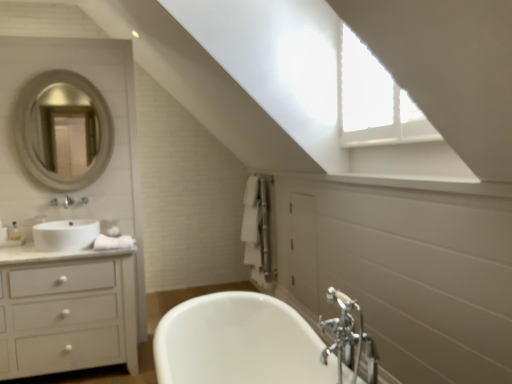
What do you see at coordinates (65, 234) in the screenshot? Image resolution: width=512 pixels, height=384 pixels. I see `white glossy sink at left` at bounding box center [65, 234].

Image resolution: width=512 pixels, height=384 pixels. What do you see at coordinates (66, 311) in the screenshot? I see `white glossy cabinet at left` at bounding box center [66, 311].

Where is `silver metallic mirror at upper left`? This screenshot has width=512, height=384. silver metallic mirror at upper left is located at coordinates (65, 129).

Which is closer, (27, 299) or (56, 224)?

Point (27, 299) appears to be closer to the viewer than point (56, 224).

In the scene shown: Considering the relative sizes of white glossy cabinet at left and white glossy sink at left in the image provided, is white glossy cabinet at left taller than white glossy sink at left?

Indeed, white glossy cabinet at left has a greater height compared to white glossy sink at left.

Would you consider white glossy cabinet at left to be distant from white glossy sink at left?

They are positioned close to each other.

Is point (340, 364) farther from camera compared to point (55, 245)?

No, (340, 364) is in front of (55, 245).

Is chrome metallic faucet at lower right to the left or to the right of white glossy sink at left in the image?

Clearly, chrome metallic faucet at lower right is on the right of white glossy sink at left in the image.

Would you say white glossy sink at left is part of chrome metallic faucet at lower right's contents?

No, white glossy sink at left is not a part of chrome metallic faucet at lower right.

From a real-world perspective, relative to white glossy sink at left, is chrome metallic faucet at lower right vertically above or below?

From a real-world perspective, chrome metallic faucet at lower right is physically below white glossy sink at left.

Is chrome metallic faucet at lower right closer to camera compared to white glossy cabinet at left?

Yes, chrome metallic faucet at lower right is in front of white glossy cabinet at left.

Does chrome metallic faucet at lower right have a smaller size compared to white glossy cabinet at left?

Indeed, chrome metallic faucet at lower right has a smaller size compared to white glossy cabinet at left.

Would you say chrome metallic faucet at lower right is outside white glossy cabinet at left?

That's correct, chrome metallic faucet at lower right is outside of white glossy cabinet at left.

Is chrome metallic faucet at lower right turned away from white glossy cabinet at left?

No, chrome metallic faucet at lower right's orientation is not away from white glossy cabinet at left.

Where is `mirror behind the white glossy sink at left`? mirror behind the white glossy sink at left is located at coordinates coord(65,129).

Can we say silver metallic mirror at upper left lies outside white glossy sink at left?

silver metallic mirror at upper left lies outside white glossy sink at left's area.

Are silver metallic mirror at upper left and white glossy sink at left beside each other?

No.

Would you say silver metallic mirror at upper left is to the left or to the right of white glossy sink at left in the picture?

In the image, silver metallic mirror at upper left appears on the left side of white glossy sink at left.

Which is behind, silver metallic mirror at upper left or white glossy cabinet at left?

silver metallic mirror at upper left is behind.

Considering the points (89, 119) and (22, 276), which point is behind, point (89, 119) or point (22, 276)?

The point (89, 119) is behind.

Is silver metallic mirror at upper left at the right side of white glossy cabinet at left?

In fact, silver metallic mirror at upper left is to the left of white glossy cabinet at left.

Is white glossy sink at left not within white glossy cabinet at left?

Yes.

Is white glossy sink at left turned away from white glossy cabinet at left?

No, white glossy sink at left is not facing away from white glossy cabinet at left.

From a real-world perspective, which is physically below, white glossy sink at left or white glossy cabinet at left?

white glossy cabinet at left is physically lower.

Measure the distance from white glossy sink at left to white glossy cabinet at left.

white glossy sink at left is 36.89 centimeters from white glossy cabinet at left.

In the scene shown: Considering the sizes of objects chrome metallic faucet at lower right and silver metallic mirror at upper left in the image provided, who is shorter, chrome metallic faucet at lower right or silver metallic mirror at upper left?

With less height is chrome metallic faucet at lower right.

What's the angular difference between chrome metallic faucet at lower right and silver metallic mirror at upper left's facing directions?

chrome metallic faucet at lower right and silver metallic mirror at upper left are facing 90.7 degrees away from each other.

From the image's perspective, which is above, chrome metallic faucet at lower right or silver metallic mirror at upper left?

silver metallic mirror at upper left appears higher in the image.

From a real-world perspective, is chrome metallic faucet at lower right on top of silver metallic mirror at upper left?

Actually, chrome metallic faucet at lower right is physically below silver metallic mirror at upper left in the real world.

This screenshot has width=512, height=384. I want to click on sink behind the white glossy cabinet at left, so click(x=65, y=234).

Identify the location of sink above the chrome metallic faucet at lower right (from a real-world perspective). [x=65, y=234].

Looking at the image, which one is located closer to white glossy sink at left, chrome metallic faucet at lower right or silver metallic mirror at upper left?

Among the two, silver metallic mirror at upper left is located nearer to white glossy sink at left.

Looking at the image, which one is located further to chrome metallic faucet at lower right, silver metallic mirror at upper left or white glossy sink at left?

Among the two, silver metallic mirror at upper left is located further to chrome metallic faucet at lower right.

Estimate the real-world distances between objects in this image. Which object is further from white glossy cabinet at left, white glossy sink at left or chrome metallic faucet at lower right?

chrome metallic faucet at lower right is further to white glossy cabinet at left.

Looking at the image, which one is located further to silver metallic mirror at upper left, white glossy cabinet at left or chrome metallic faucet at lower right?

Among the two, chrome metallic faucet at lower right is located further to silver metallic mirror at upper left.

Based on the photo, when comparing their distances from white glossy sink at left, does white glossy cabinet at left or silver metallic mirror at upper left seem further?

silver metallic mirror at upper left lies further to white glossy sink at left than the other object.

When comparing their distances from white glossy sink at left, does silver metallic mirror at upper left or white glossy cabinet at left seem further?

silver metallic mirror at upper left.

When comparing their distances from chrome metallic faucet at lower right, does white glossy cabinet at left or white glossy sink at left seem further?

white glossy sink at left is further to chrome metallic faucet at lower right.

Based on the photo, which object lies further to the anchor point chrome metallic faucet at lower right, white glossy cabinet at left or silver metallic mirror at upper left?

silver metallic mirror at upper left.

Find the location of a particular element. sink situated between silver metallic mirror at upper left and chrome metallic faucet at lower right from left to right is located at coordinates (65, 234).

The width and height of the screenshot is (512, 384). In order to click on sink between silver metallic mirror at upper left and white glossy cabinet at left from top to bottom in this screenshot , I will do `click(65, 234)`.

This screenshot has width=512, height=384. What are the coordinates of `sink located between white glossy cabinet at left and chrome metallic faucet at lower right in the left-right direction` in the screenshot? It's located at (65, 234).

Where is `bathroom cabinet between silver metallic mirror at upper left and chrome metallic faucet at lower right`? bathroom cabinet between silver metallic mirror at upper left and chrome metallic faucet at lower right is located at coordinates (66, 311).